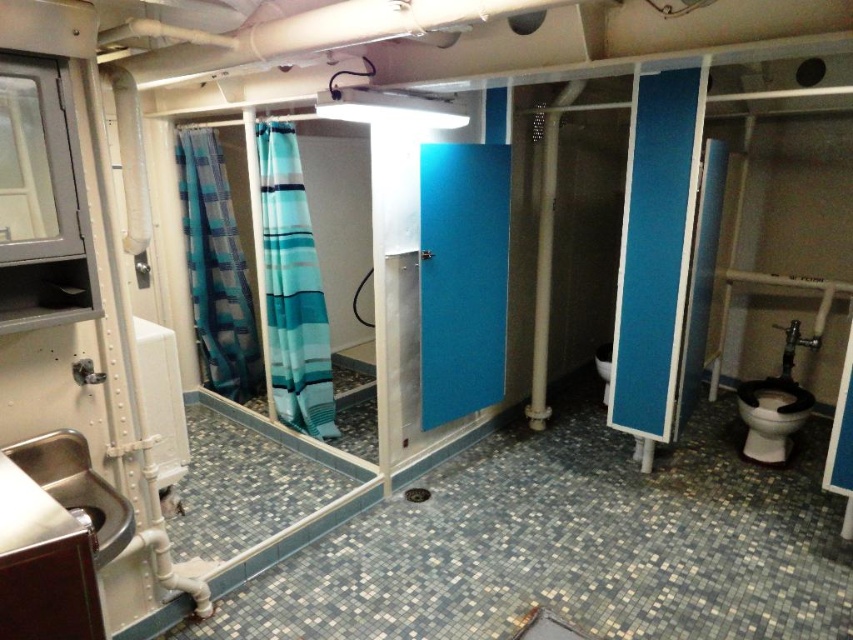
Is teal striped fabric at left wider than blue striped fabric at left?

In fact, teal striped fabric at left might be narrower than blue striped fabric at left.

Can you confirm if teal striped fabric at left is smaller than blue striped fabric at left?

Yes, teal striped fabric at left is smaller than blue striped fabric at left.

Does point (289, 356) come behind point (178, 184)?

No.

Image resolution: width=853 pixels, height=640 pixels. In order to click on teal striped fabric at left in this screenshot , I will do `click(292, 289)`.

Which is above, teal striped fabric at left or black glossy toilet bowl at lower right?

teal striped fabric at left is above.

Can you confirm if teal striped fabric at left is positioned above black glossy toilet bowl at lower right?

Indeed, teal striped fabric at left is positioned over black glossy toilet bowl at lower right.

The image size is (853, 640). What are the coordinates of `teal striped fabric at left` in the screenshot? It's located at (292, 289).

Identify the location of teal striped fabric at left. The width and height of the screenshot is (853, 640). (292, 289).

Consider the image. Is the position of stainless steel sink at lower left more distant than that of black glossy toilet bowl at lower right?

No.

The image size is (853, 640). Describe the element at coordinates (77, 486) in the screenshot. I see `stainless steel sink at lower left` at that location.

Locate an element on the screen. The width and height of the screenshot is (853, 640). stainless steel sink at lower left is located at coordinates (77, 486).